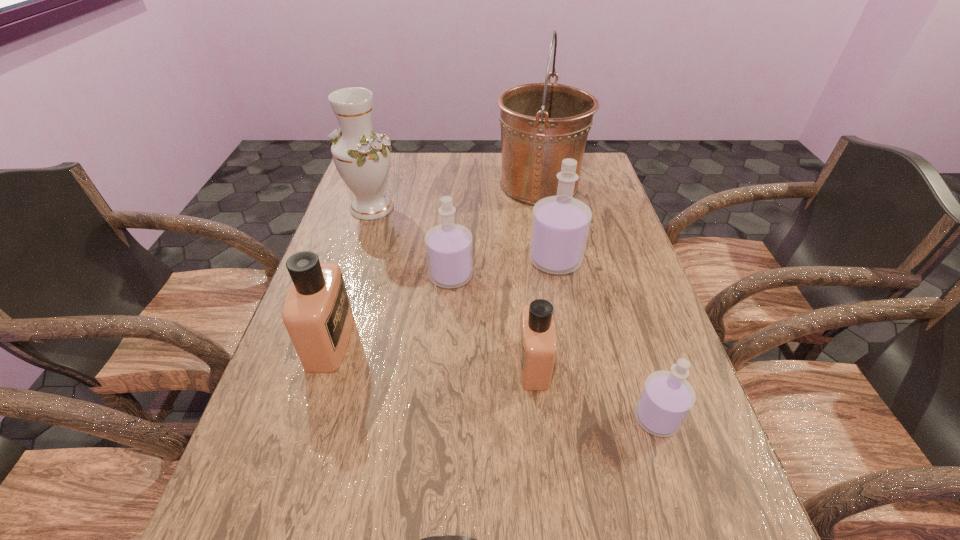
What are the coordinates of `bucket` in the screenshot? It's located at pyautogui.click(x=542, y=124).

The height and width of the screenshot is (540, 960). Find the location of `vase`. vase is located at coordinates (362, 157).

Identify the location of the third tallest object. (560, 224).

Locate an element on the screen. The image size is (960, 540). the biggest purple perfume is located at coordinates (560, 224).

Identify the location of the second smallest purple perfume. (449, 251).

Identify the location of the second perfume from left to right. This screenshot has height=540, width=960. (449, 251).

Locate an element on the screen. the bigger beige perfume is located at coordinates (317, 314).

I want to click on the left beige perfume, so (317, 314).

Where is `the right beige perfume`? the right beige perfume is located at coordinates (537, 347).

Image resolution: width=960 pixels, height=540 pixels. In order to click on the rightmost perfume in this screenshot , I will do `click(666, 399)`.